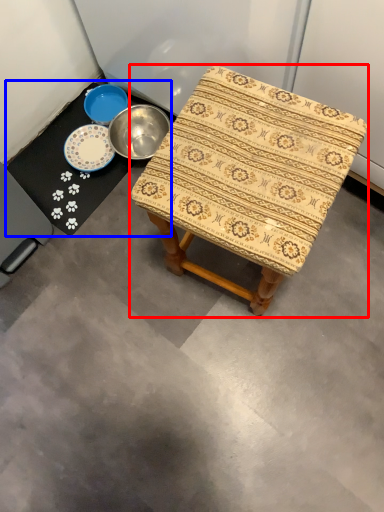
Question: Which point is further to the camera, stool (highlighted by a red box) or round table (highlighted by a blue box)?

Choices:
 (A) stool
 (B) round table

Answer: (B)